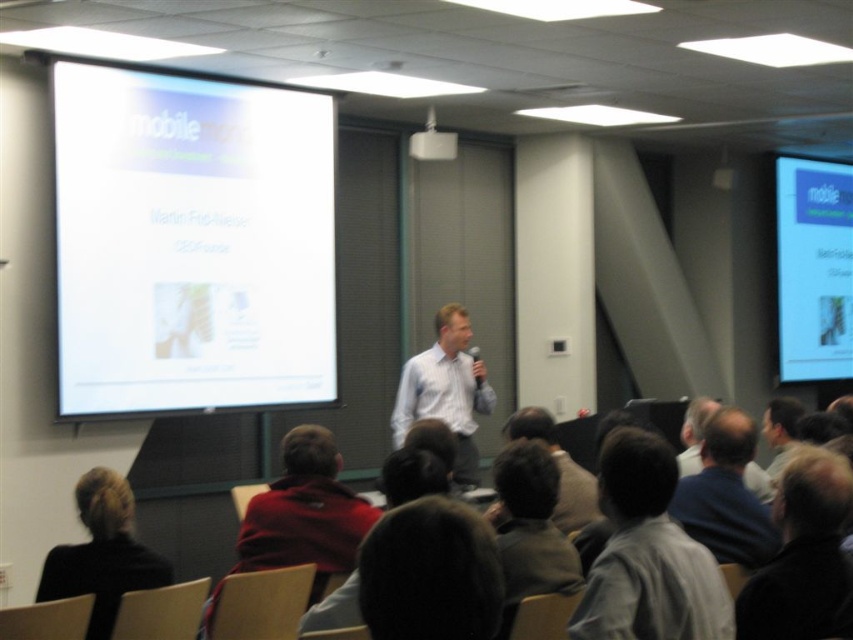
Question: Which of the following is the closest to the observer?

Choices:
 (A) (437, 141)
 (B) (483, 390)
 (C) (525, 532)
 (D) (759, 522)

Answer: (C)

Question: Is dark brown hair at center below white plastic projector at upper center?

Choices:
 (A) no
 (B) yes

Answer: (B)

Question: Which point is closer to the camera?

Choices:
 (A) (579, 605)
 (B) (801, 497)
 (C) (564, 588)
 (D) (444, 353)

Answer: (A)

Question: Is white glossy projector screen at upper left above dark gray hair at upper right?

Choices:
 (A) yes
 (B) no

Answer: (A)

Question: Which point is farther from the camera taking this photo?

Choices:
 (A) (595, 497)
 (B) (370, 620)

Answer: (A)

Question: Is white glossy projector screen at upper left wider than matte white projector screen at upper right?

Choices:
 (A) no
 (B) yes

Answer: (B)